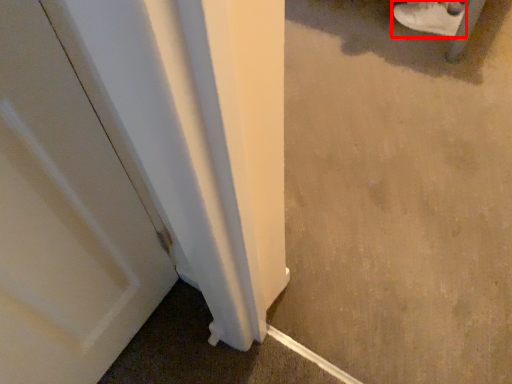
Question: From the image's perspective, where is footwear (annotated by the red box) located in relation to concrete in the image?

Choices:
 (A) below
 (B) above

Answer: (B)